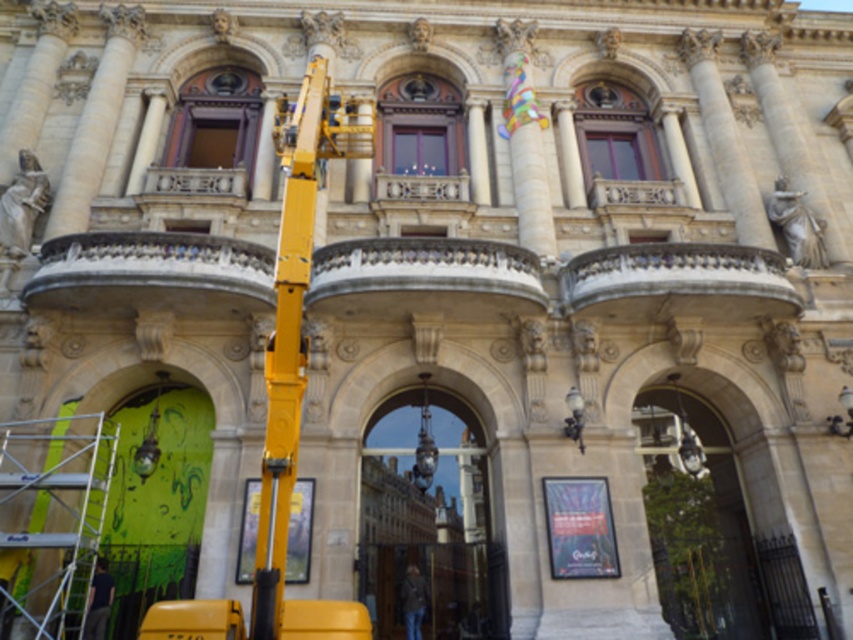
Question: Does dark blue jeans at lower left have a smaller size compared to dark brown leather jacket at lower center?

Choices:
 (A) no
 (B) yes

Answer: (B)

Question: Which object is positioned closest to the dark blue jeans at lower left?

Choices:
 (A) dark brown leather jacket at lower center
 (B) silver metallic scaffolding at lower left
 (C) yellow metallic crane at left

Answer: (B)

Question: Can you confirm if dark blue jeans at lower left is thinner than dark brown leather jacket at lower center?

Choices:
 (A) yes
 (B) no

Answer: (A)

Question: Which is nearer to the dark blue jeans at lower left?

Choices:
 (A) silver metallic scaffolding at lower left
 (B) dark brown leather jacket at lower center
 (C) yellow metallic crane at left

Answer: (A)

Question: Can you confirm if yellow metallic crane at left is positioned above silver metallic scaffolding at lower left?

Choices:
 (A) no
 (B) yes

Answer: (B)

Question: Which of the following is the farthest from the observer?

Choices:
 (A) silver metallic scaffolding at lower left
 (B) dark blue jeans at lower left
 (C) dark brown leather jacket at lower center
 (D) yellow metallic crane at left

Answer: (C)